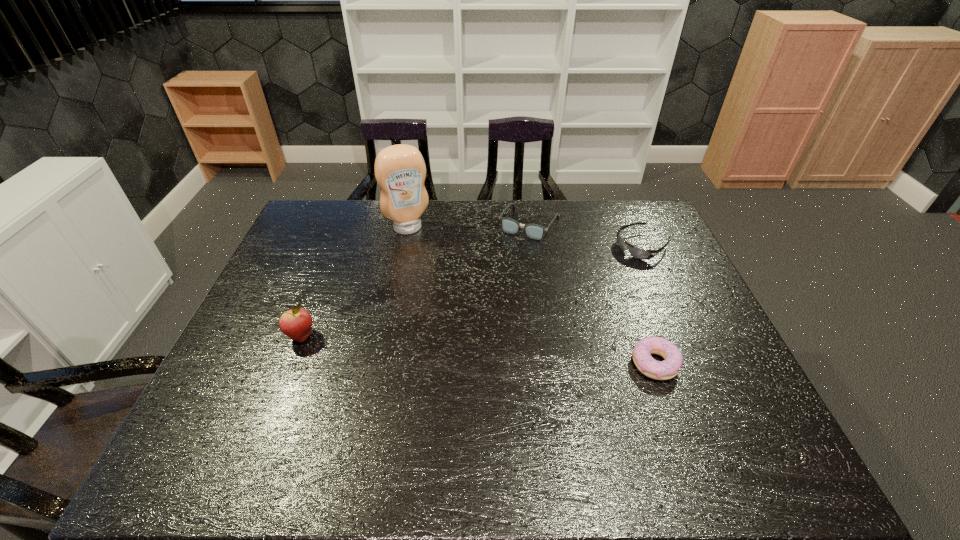
Where is `condiment present at the far edge`? The height and width of the screenshot is (540, 960). condiment present at the far edge is located at coordinates (400, 171).

You are a GUI agent. You are given a task and a screenshot of the screen. Output one action in this format:
    pyautogui.click(x=<x>, y=<y>)
    Task: Click on the sunglasses that is at the far edge
    The image size is (960, 540).
    Given the screenshot: What is the action you would take?
    pyautogui.click(x=635, y=252)

The image size is (960, 540). Identify the location of object that is at the left edge. (296, 323).

At what (x,y) coordinates should I click in order to perform the action: click on doughnut that is at the right edge. Please return your answer as a coordinate pair (x, y). The image size is (960, 540). Looking at the image, I should click on (667, 369).

The height and width of the screenshot is (540, 960). I want to click on sunglasses at the right edge, so click(635, 252).

I want to click on object situated at the far right corner, so click(635, 252).

Identify the location of vacant position at the far edge of the desktop. This screenshot has height=540, width=960. (572, 202).

Locate an element on the screen. The height and width of the screenshot is (540, 960). free spot at the near edge of the desktop is located at coordinates (336, 397).

This screenshot has height=540, width=960. Identify the location of vacant space at the left edge. (298, 264).

At what (x,y) coordinates should I click in order to perform the action: click on free point at the right edge. Please return your answer as a coordinate pair (x, y). Looking at the image, I should click on (706, 383).